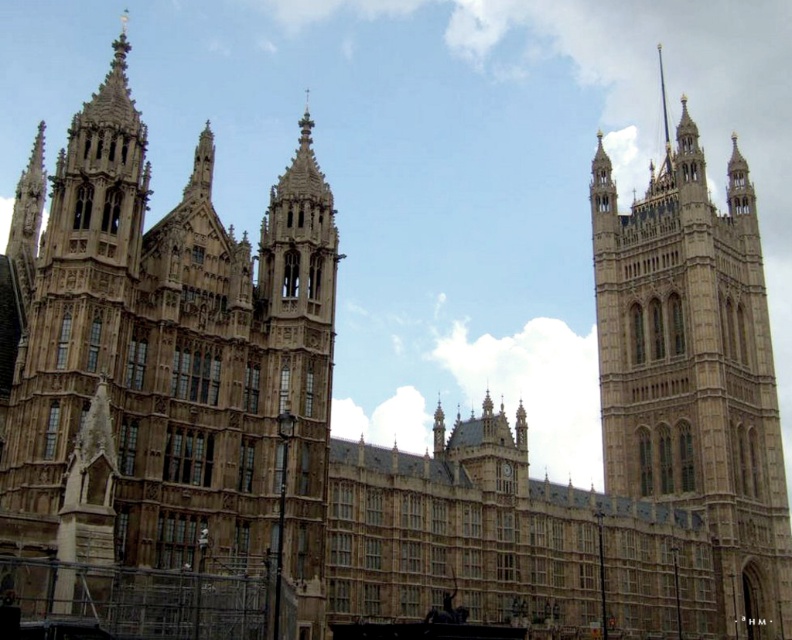
Question: Which point is farther to the camera?

Choices:
 (A) [287, 561]
 (B) [787, 557]

Answer: (B)

Question: Can you confirm if brown stone tower at left is positioned above beige stone tower at right?

Choices:
 (A) yes
 (B) no

Answer: (A)

Question: Which object appears farthest from the camera in this image?

Choices:
 (A) beige stone tower at right
 (B) brown stone tower at left

Answer: (A)

Question: Can you confirm if brown stone tower at left is positioned above beige stone tower at right?

Choices:
 (A) yes
 (B) no

Answer: (A)

Question: Is brown stone tower at left positioned before beige stone tower at right?

Choices:
 (A) no
 (B) yes

Answer: (B)